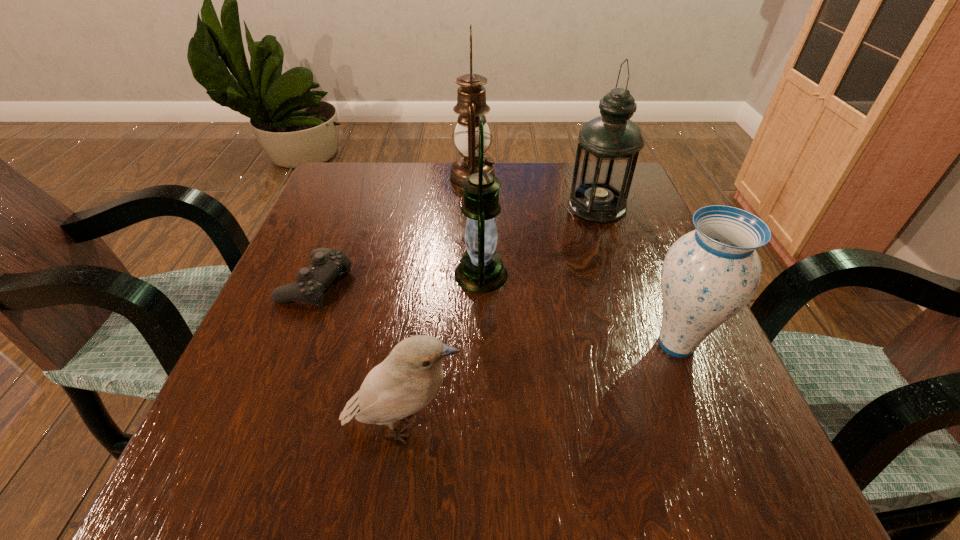
Where is `vacant space located 0.370m on the left of the right oil lamp`? The width and height of the screenshot is (960, 540). vacant space located 0.370m on the left of the right oil lamp is located at coordinates point(410,206).

Locate an element on the screen. blank area located 0.050m on the side where the lantern emits light is located at coordinates (428, 274).

Locate an element on the screen. free space located 0.250m on the side where the lantern emits light is located at coordinates (326, 274).

The image size is (960, 540). In order to click on vacant space located 0.070m on the side where the lantern emits light in this screenshot , I will do `click(419, 274)`.

Find the location of a particular element. vacant area located 0.290m on the left of the fifth farthest object is located at coordinates (466, 344).

Find the location of a particular element. vacant space positioned at the beak of the fifth tallest object is located at coordinates (667, 426).

At what (x,y) coordinates should I click in order to perform the action: click on vacant space positioned 0.300m on the right of the shortest object. Please return your answer as a coordinate pair (x, y). The width and height of the screenshot is (960, 540). Looking at the image, I should click on (507, 282).

Find the location of a particular element. The height and width of the screenshot is (540, 960). object at the near edge is located at coordinates (407, 380).

The width and height of the screenshot is (960, 540). In order to click on object at the left edge in this screenshot , I will do `click(326, 264)`.

Find the location of a particular element. Image resolution: width=960 pixels, height=540 pixels. oil lamp present at the right edge is located at coordinates (609, 145).